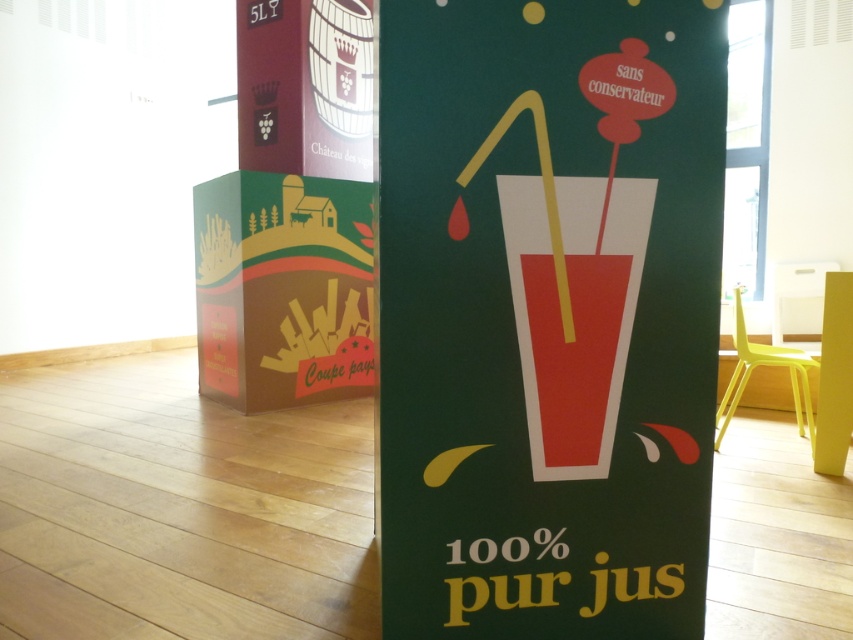
You are standing at the entrance of the room and want to locate the green paperboard sign at center. According to the coordinates given, where should you look relative to the center of the image?

The green paperboard sign at center is located at coordinates 0.492 on the x axis and 0.642 on the y axis, which is very close to the center of the image but slightly to the right and slightly below the exact center point.

You are a customer standing in front of the two promotional stands. You want to take a photo of the matte red glass at center without the green paperboard sign at center blocking it. Is it possible to do so without moving any objects?

The green paperboard sign at center is closer to the viewer than matte red glass at center, so it would block the view. You cannot take a photo of the matte red glass at center without the green paperboard sign at center blocking it without moving any objects.